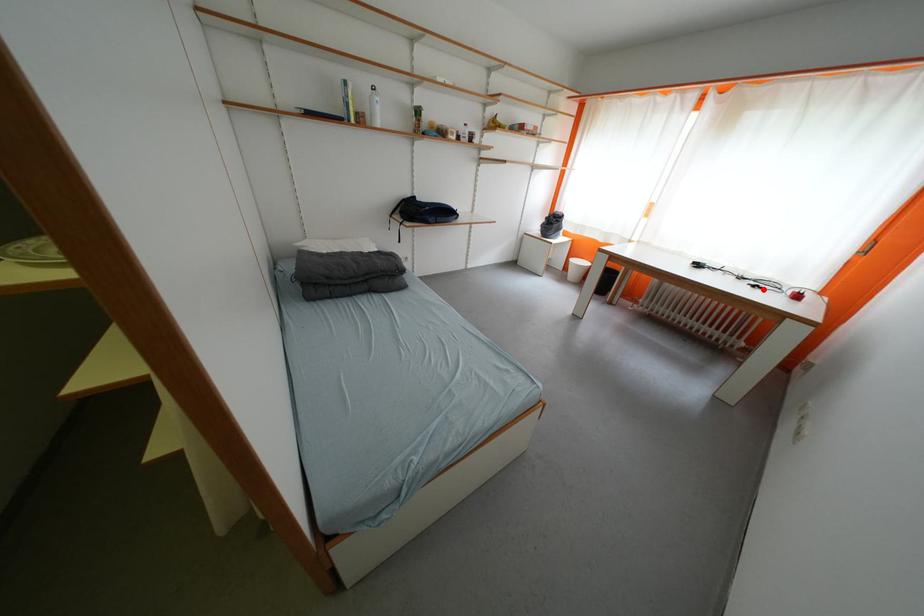
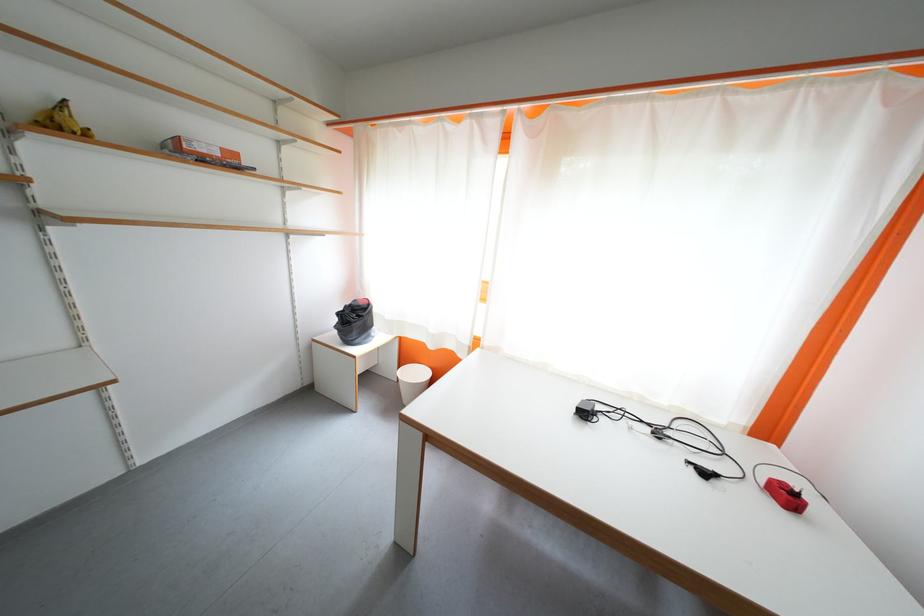
In the second image, find the point that corresponds to the highlighted location in the first image.

(713, 477)